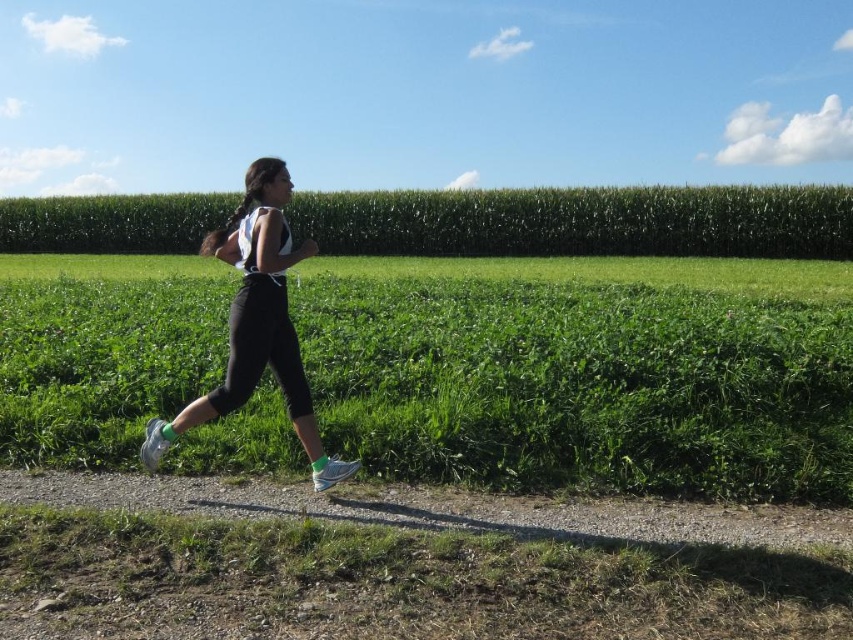
You are a hiker planning to walk along the gravel path at center. The path is bordered by crops that are 14.55 feet apart. If your backpack has a width of 2 feet, can you safely walk through the path without touching the crops?

The crops are 14.55 feet apart, so the path between them is wide enough for a backpack of 2 feet. You can safely walk through the gravel path at center without touching the crops.

You are a photographer trying to capture the jogger in the image. To ensure the green grass at center and white mesh running shoe at lower center are both clearly visible in the photo, which object should be in focus?

The green grass at center should be in focus because it is positioned over the white mesh running shoe at lower center, meaning it is closer to the camera and would remain sharp if focused on.

You are a drone operator trying to capture the best aerial shot of the jogging person. The camera is currently positioned at the point indicated by point (585, 372). To get a clear view of the person jogging, should you adjust the camera position upwards or downwards? Please explain your reasoning based on the scene description.

The point (585, 372) indicates green grass at center. Since the jogging person is on the dirt path surrounded by green grass, adjusting the camera position upwards would move the camera away from the grass towards the person, providing a clearer view of them jogging along the path.